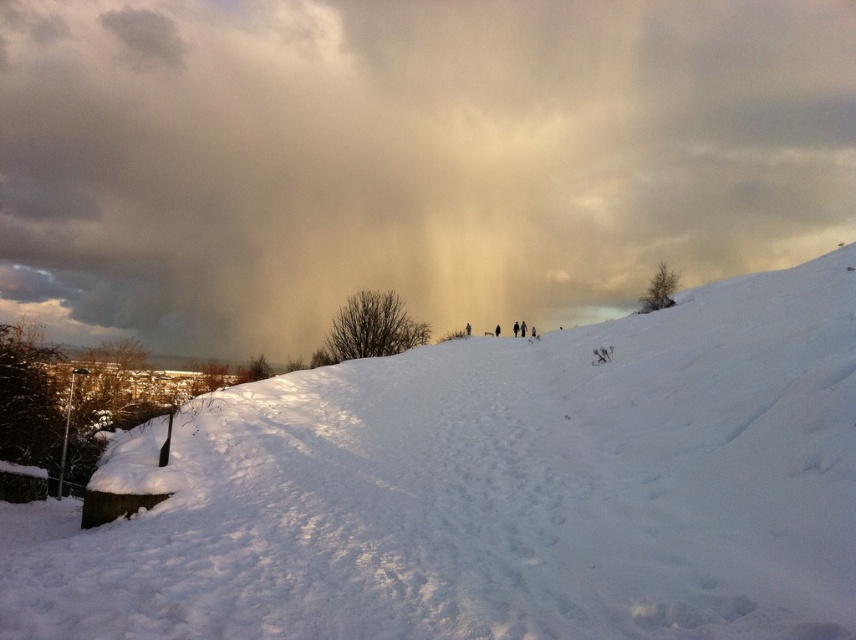
Does cloudy sky at upper center appear on the left side of white fluffy snow at center?

Correct, you'll find cloudy sky at upper center to the left of white fluffy snow at center.

Between cloudy sky at upper center and white fluffy snow at center, which one has less height?

With less height is white fluffy snow at center.

This screenshot has height=640, width=856. What are the coordinates of `cloudy sky at upper center` in the screenshot? It's located at tap(406, 157).

Identify the location of cloudy sky at upper center. (406, 157).